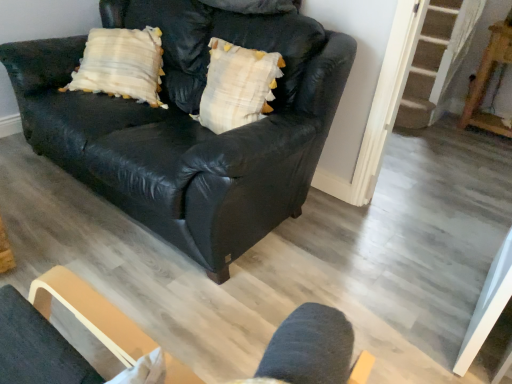
In order to face black leather couch at center, should I rotate leftwards or rightwards?

You should look left and rotate roughly 11.114 degrees.

Describe the element at coordinates (189, 126) in the screenshot. The height and width of the screenshot is (384, 512). I see `black leather couch at center` at that location.

Measure the distance between wooden table at right and camera.

9.65 feet.

This screenshot has height=384, width=512. Identify the location of white textured pillow at center. (237, 86).

Considering the relative sizes of white textured pillow at center and wooden table at right in the image provided, is white textured pillow at center bigger than wooden table at right?

Incorrect, white textured pillow at center is not larger than wooden table at right.

Can you confirm if white textured pillow at center is shorter than wooden table at right?

Yes, white textured pillow at center is shorter than wooden table at right.

Which is more to the right, white textured pillow at center or wooden table at right?

From the viewer's perspective, wooden table at right appears more on the right side.

Considering the points (277, 63) and (495, 49), which point is behind, point (277, 63) or point (495, 49)?

The point (495, 49) is more distant.

From a real-world perspective, which is physically above, black leather couch at center or white textured pillow at center?

white textured pillow at center is physically above.

Is black leather couch at center directly adjacent to white textured pillow at center?

No, black leather couch at center is not next to white textured pillow at center.

Between black leather couch at center and white textured pillow at center, which one has more height?

With more height is black leather couch at center.

Considering the relative sizes of black leather couch at center and white textured pillow at center in the image provided, is black leather couch at center thinner than white textured pillow at center?

No, black leather couch at center is not thinner than white textured pillow at center.

Can you confirm if wooden table at right is wider than white textured pillow at center?

Yes, wooden table at right is wider than white textured pillow at center.

From a real-world perspective, does wooden table at right sit lower than white textured pillow at center?

Yes, from a real-world perspective, wooden table at right is below white textured pillow at center.

Can you confirm if wooden table at right is shorter than white textured pillow at center?

No, wooden table at right is not shorter than white textured pillow at center.

Is wooden table at right oriented away from white textured pillow at center?

wooden table at right does not have its back to white textured pillow at center.

Would you say wooden table at right is outside black leather couch at center?

wooden table at right lies outside black leather couch at center's area.

Between wooden table at right and black leather couch at center, which one has more height?

black leather couch at center.

From a real-world perspective, is wooden table at right on black leather couch at center?

Actually, wooden table at right is physically below black leather couch at center in the real world.

From the image's perspective, who appears lower, wooden table at right or black leather couch at center?

black leather couch at center appears lower in the image.

Looking at the image, does white textured pillow at center seem bigger or smaller compared to black leather couch at center?

white textured pillow at center is smaller than black leather couch at center.

Is white textured pillow at center looking in the opposite direction of black leather couch at center?

Yes.

Which is more to the left, white textured pillow at center or black leather couch at center?

black leather couch at center is more to the left.

Would you say black leather couch at center is part of white textured pillow at center's contents?

No, black leather couch at center is not a part of white textured pillow at center.

Consider the image. Would you say black leather couch at center contains wooden table at right?

No, black leather couch at center does not contain wooden table at right.

Which is further, [232,178] or [503,41]?

The point [503,41] is farther from the camera.

Which of these two, black leather couch at center or wooden table at right, stands shorter?

With less height is wooden table at right.

Are black leather couch at center and wooden table at right far apart?

Yes, black leather couch at center and wooden table at right are located far from each other.

At what (x,y) coordinates should I click in order to perform the action: click on table on the right of white textured pillow at center. Please return your answer as a coordinate pair (x, y). The width and height of the screenshot is (512, 384). Looking at the image, I should click on (488, 81).

Find the location of a particular element. studio couch in front of the white textured pillow at center is located at coordinates (189, 126).

From the image, which object appears to be nearer to black leather couch at center, white textured pillow at center or wooden table at right?

white textured pillow at center is positioned closer to the anchor black leather couch at center.

Estimate the real-world distances between objects in this image. Which object is further from black leather couch at center, wooden table at right or white textured pillow at center?

wooden table at right is positioned further to the anchor black leather couch at center.

Considering their positions, is wooden table at right positioned closer to white textured pillow at center than black leather couch at center?

The object closer to white textured pillow at center is black leather couch at center.

Looking at this image, which object lies nearer to the anchor point wooden table at right, white textured pillow at center or black leather couch at center?

white textured pillow at center lies closer to wooden table at right than the other object.

Considering their positions, is black leather couch at center positioned further to white textured pillow at center than wooden table at right?

Based on the image, wooden table at right appears to be further to white textured pillow at center.

Estimate the real-world distances between objects in this image. Which object is further from wooden table at right, black leather couch at center or white textured pillow at center?

Among the two, black leather couch at center is located further to wooden table at right.

The image size is (512, 384). What are the coordinates of `pillow situated between black leather couch at center and wooden table at right from left to right` in the screenshot? It's located at (237, 86).